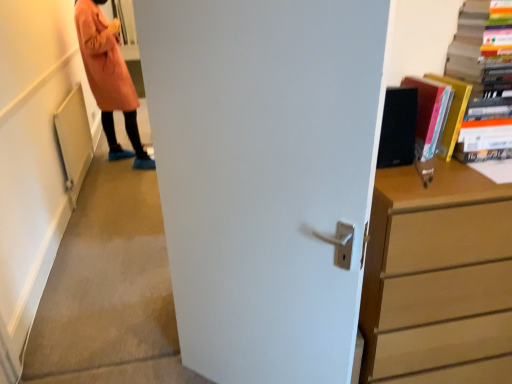
Question: Considering the relative sizes of hardcover book at upper right, which appears as the 1th book when viewed from the right, and matte black book at upper right, placed as the second book when sorted from right to left, in the image provided, is hardcover book at upper right, which appears as the 1th book when viewed from the right, wider than matte black book at upper right, placed as the second book when sorted from right to left,?

Choices:
 (A) no
 (B) yes

Answer: (B)

Question: From a real-world perspective, is hardcover book at upper right, placed as the second book when sorted from left to right, located higher than matte black book at upper right, placed as the second book when sorted from right to left?

Choices:
 (A) yes
 (B) no

Answer: (A)

Question: Is hardcover book at upper right, placed as the second book when sorted from left to right, in front of matte black book at upper right, placed as the second book when sorted from right to left?

Choices:
 (A) no
 (B) yes

Answer: (B)

Question: Considering the relative sizes of hardcover book at upper right, placed as the second book when sorted from left to right, and matte black book at upper right, placed as the second book when sorted from right to left, in the image provided, is hardcover book at upper right, placed as the second book when sorted from left to right, thinner than matte black book at upper right, placed as the second book when sorted from right to left,?

Choices:
 (A) no
 (B) yes

Answer: (A)

Question: From the image's perspective, is hardcover book at upper right, placed as the second book when sorted from left to right, located beneath matte black book at upper right, placed as the second book when sorted from right to left?

Choices:
 (A) yes
 (B) no

Answer: (B)

Question: From the image's perspective, is wooden chest of drawers at right above or below white matte door at center?

Choices:
 (A) below
 (B) above

Answer: (A)

Question: From a real-world perspective, is wooden chest of drawers at right physically located above or below white matte door at center?

Choices:
 (A) below
 (B) above

Answer: (A)

Question: Would you say wooden chest of drawers at right is inside or outside white matte door at center?

Choices:
 (A) inside
 (B) outside

Answer: (B)

Question: In the image, is wooden chest of drawers at right positioned in front of or behind white matte door at center?

Choices:
 (A) behind
 (B) front

Answer: (A)

Question: Choose the correct answer: Is matte black book at upper right, which is counted as the first book, starting from the left, inside white matte door at center or outside it?

Choices:
 (A) outside
 (B) inside

Answer: (A)

Question: Considering the positions of matte black book at upper right, which is counted as the first book, starting from the left, and white matte door at center in the image, is matte black book at upper right, which is counted as the first book, starting from the left, bigger or smaller than white matte door at center?

Choices:
 (A) small
 (B) big

Answer: (A)

Question: In terms of height, does matte black book at upper right, placed as the second book when sorted from right to left, look taller or shorter compared to white matte door at center?

Choices:
 (A) short
 (B) tall

Answer: (A)

Question: Looking at their shapes, would you say matte black book at upper right, which is counted as the first book, starting from the left, is wider or thinner than white matte door at center?

Choices:
 (A) thin
 (B) wide

Answer: (B)

Question: Based on their sizes in the image, would you say matte black book at upper right, placed as the second book when sorted from right to left, is bigger or smaller than hardcover book at upper right, which appears as the 1th book when viewed from the right?

Choices:
 (A) big
 (B) small

Answer: (B)

Question: From their relative heights in the image, would you say matte black book at upper right, which is counted as the first book, starting from the left, is taller or shorter than hardcover book at upper right, placed as the second book when sorted from left to right?

Choices:
 (A) tall
 (B) short

Answer: (B)